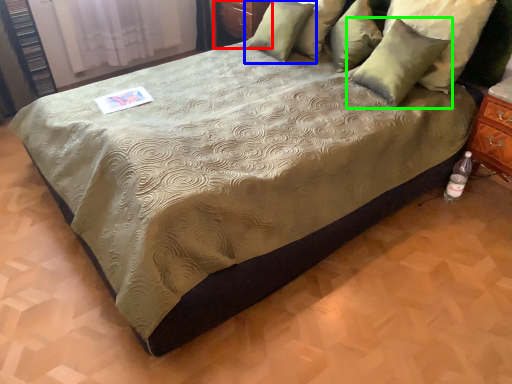
Question: Which object is the farthest from dresser (highlighted by a red box)? Choose among these: pillow (highlighted by a blue box) or pillow (highlighted by a green box).

Choices:
 (A) pillow
 (B) pillow

Answer: (B)